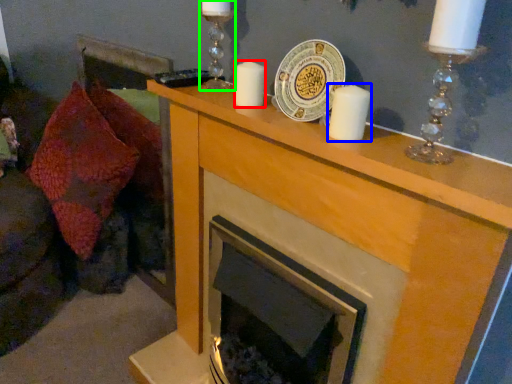
Question: Which object is the farthest from candle (highlighted by a red box)? Choose among these: candle (highlighted by a blue box) or candle holder (highlighted by a green box).

Choices:
 (A) candle
 (B) candle holder

Answer: (A)